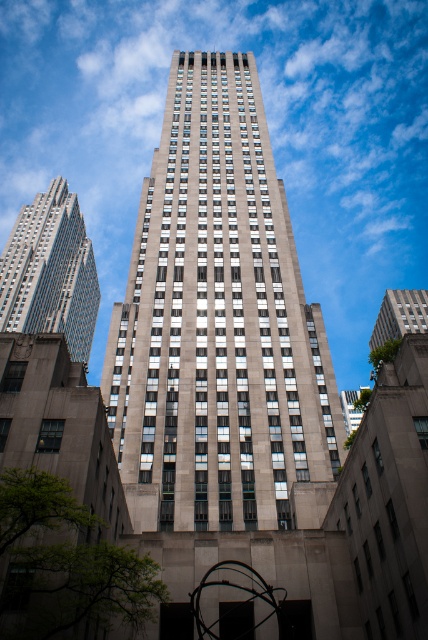
You are an architect analyzing the skyline of a city. You observe the gray stone building at center and the silver glass skyscraper at left. Based on their positions and heights, which building would cast a longer shadow during midday when the sun is directly overhead?

The silver glass skyscraper at left is taller than the gray stone building at center, so it would cast a longer shadow during midday when the sun is directly overhead.

You are standing in front of a skyscraper and looking up. There is a point marked at coordinates (50, 272). Based on the scene description, which object does this point correspond to?

The point at coordinates (50, 272) corresponds to the silver glass skyscraper at left as described in the scene.

You are standing in front of the skyscraper and want to take a photo of the silver glass skyscraper at left and the gray stone building at upper right. Which building should you look up towards to capture both in your frame?

You should look up towards the silver glass skyscraper at left because it is located above the gray stone building at upper right, so capturing it from a higher angle will include both in the frame.